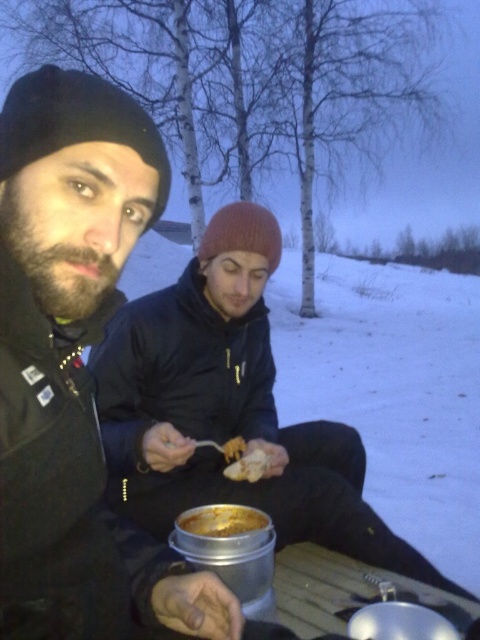
Question: Is golden brown crusty bread at center behind white crumbly bread at center?

Choices:
 (A) yes
 (B) no

Answer: (B)

Question: Which point is closer to the camera?

Choices:
 (A) golden brown crusty bread at center
 (B) white crumbly bread at center

Answer: (A)

Question: Which of the following is the farthest from the observer?

Choices:
 (A) golden brown crusty bread at center
 (B) white crumbly bread at center

Answer: (B)

Question: Is golden brown crusty bread at center above white crumbly bread at center?

Choices:
 (A) yes
 (B) no

Answer: (B)

Question: Can you confirm if golden brown crusty bread at center is thinner than white crumbly bread at center?

Choices:
 (A) no
 (B) yes

Answer: (A)